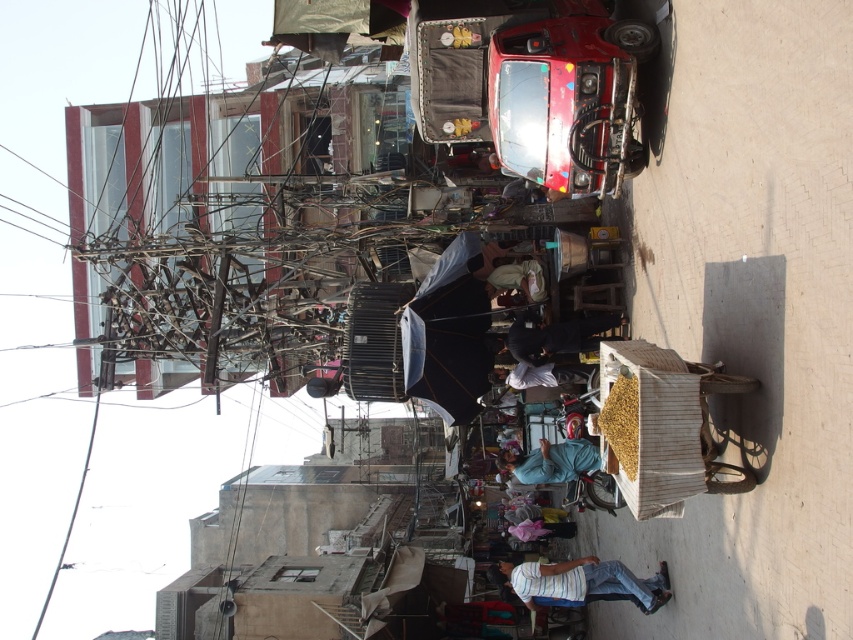
Question: Which point is closer to the camera?

Choices:
 (A) striped cotton shirt at lower center
 (B) black fabric at center

Answer: (A)

Question: Can you confirm if striped cotton shirt at lower center is bigger than blue fabric at center?

Choices:
 (A) no
 (B) yes

Answer: (B)

Question: Can you confirm if black fabric at center is positioned above blue fabric at center?

Choices:
 (A) no
 (B) yes

Answer: (B)

Question: Which point appears farthest from the camera in this image?

Choices:
 (A) (502, 586)
 (B) (553, 467)
 (C) (524, 356)

Answer: (A)

Question: Which object is closer to the camera taking this photo?

Choices:
 (A) striped cotton shirt at lower center
 (B) black fabric at center

Answer: (A)

Question: Does striped cotton shirt at lower center appear on the right side of blue fabric at center?

Choices:
 (A) yes
 (B) no

Answer: (A)